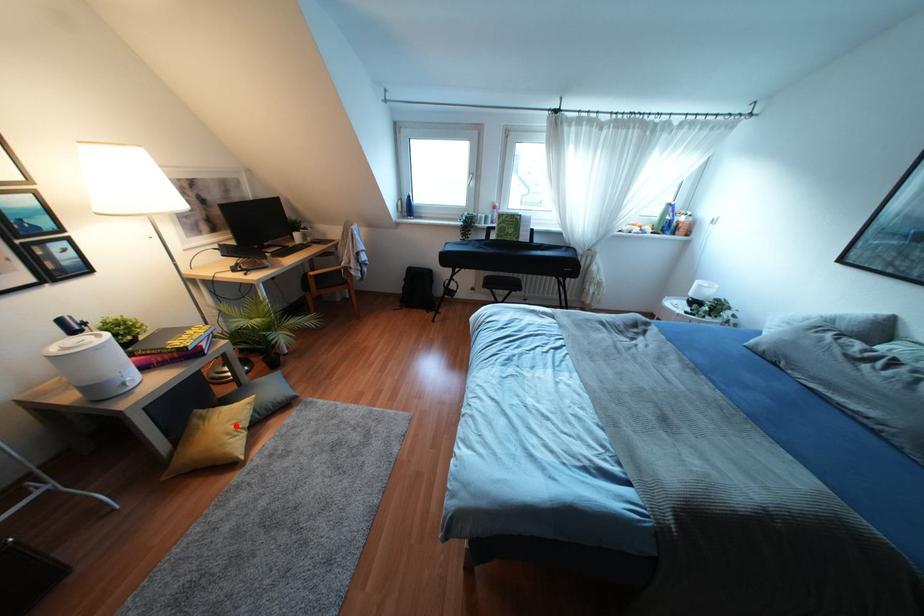
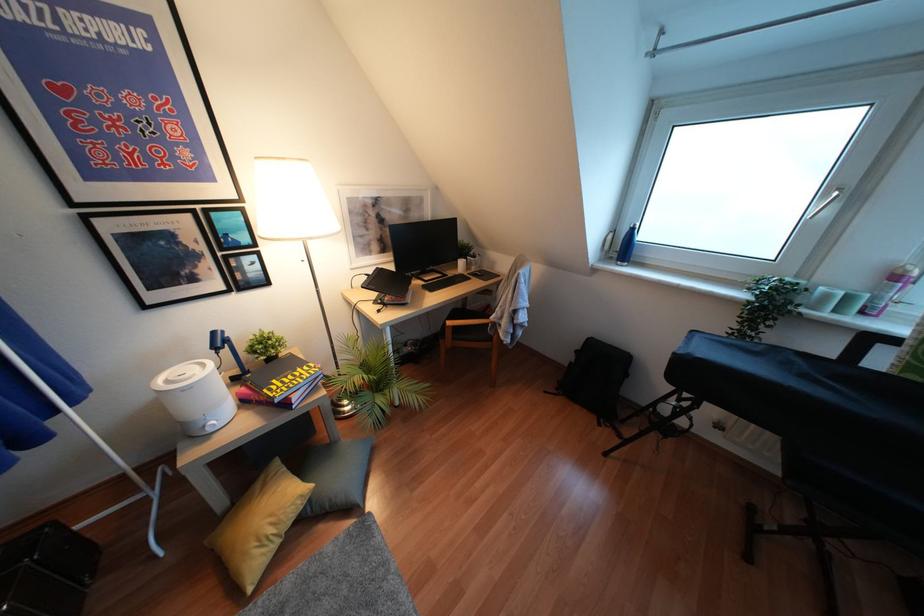
Find the pixel in the second image that matches the highlighted location in the first image.

(271, 530)